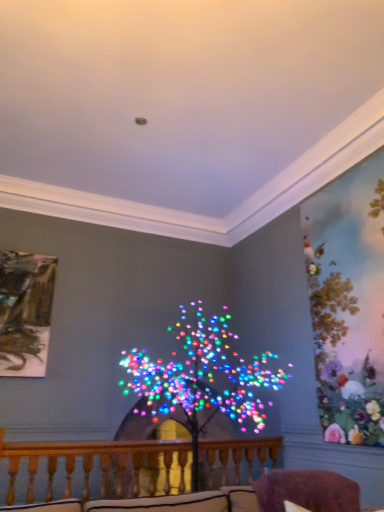
Locate an element on the screen. This screenshot has height=512, width=384. multicolored lights at center is located at coordinates (202, 377).

This screenshot has height=512, width=384. What are the coordinates of `purple fuzzy swivel chair at lower right` in the screenshot? It's located at click(307, 490).

Considering the relative sizes of multicolored lights at center and purple fuzzy swivel chair at lower right in the image provided, is multicolored lights at center bigger than purple fuzzy swivel chair at lower right?

Correct, multicolored lights at center is larger in size than purple fuzzy swivel chair at lower right.

Could you tell me if multicolored lights at center is turned towards purple fuzzy swivel chair at lower right?

Yes, multicolored lights at center is oriented towards purple fuzzy swivel chair at lower right.

Does point (174, 391) lie behind point (332, 474)?

That is True.

Is multicolored lights at center thinner than purple fuzzy swivel chair at lower right?

No, multicolored lights at center is not thinner than purple fuzzy swivel chair at lower right.

Locate an element on the screen. This screenshot has height=512, width=384. christmas decoration on the right of wooden at center is located at coordinates (202, 377).

Considering the sizes of objects multicolored lights at center and wooden at center in the image provided, who is thinner, multicolored lights at center or wooden at center?

Thinner between the two is wooden at center.

From the image's perspective, is multicolored lights at center positioned above or below wooden at center?

Based on their image positions, multicolored lights at center is located above wooden at center.

Is point (247, 368) farther from camera compared to point (3, 455)?

That is True.

Between wooden at center and multicolored lights at center, which one appears on the right side from the viewer's perspective?

Positioned to the right is multicolored lights at center.

From a real-world perspective, who is located higher, wooden at center or multicolored lights at center?

From a 3D spatial view, multicolored lights at center is above.

Does wooden at center turn towards multicolored lights at center?

Yes, wooden at center is oriented towards multicolored lights at center.

Is purple fuzzy swivel chair at lower right situated inside wooden at center or outside?

purple fuzzy swivel chair at lower right is not enclosed by wooden at center.

From a real-world perspective, who is located higher, purple fuzzy swivel chair at lower right or wooden at center?

purple fuzzy swivel chair at lower right, from a real-world perspective.

Could you tell me if purple fuzzy swivel chair at lower right is facing wooden at center?

No, purple fuzzy swivel chair at lower right is not aimed at wooden at center.

From the image's perspective, between purple fuzzy swivel chair at lower right and wooden at center, who is located below?

wooden at center appears lower in the image.

Is purple fuzzy swivel chair at lower right shorter than multicolored lights at center?

Indeed, purple fuzzy swivel chair at lower right has a lesser height compared to multicolored lights at center.

Could you tell me if purple fuzzy swivel chair at lower right is turned towards multicolored lights at center?

No.

Is purple fuzzy swivel chair at lower right next to multicolored lights at center?

No, purple fuzzy swivel chair at lower right is not touching multicolored lights at center.

In the image, there is a purple fuzzy swivel chair at lower right. At what (x,y) coordinates should I click in order to perform the action: click on christmas decoration below it (from the image's perspective). Please return your answer as a coordinate pair (x, y). This screenshot has height=512, width=384. Looking at the image, I should click on (202, 377).

Does wooden at center have a lesser height compared to purple fuzzy swivel chair at lower right?

No, wooden at center is not shorter than purple fuzzy swivel chair at lower right.

Is purple fuzzy swivel chair at lower right a part of wooden at center?

Actually, purple fuzzy swivel chair at lower right is outside wooden at center.

Are wooden at center and purple fuzzy swivel chair at lower right beside each other?

No, wooden at center is not in contact with purple fuzzy swivel chair at lower right.

Which object is positioned more to the left, wooden at center or purple fuzzy swivel chair at lower right?

wooden at center is more to the left.

Image resolution: width=384 pixels, height=512 pixels. Identify the location of swivel chair below the multicolored lights at center (from a real-world perspective). (307, 490).

Image resolution: width=384 pixels, height=512 pixels. In order to click on christmas decoration positioned vertically above the wooden at center (from a real-world perspective) in this screenshot , I will do `click(202, 377)`.

When comparing their distances from purple fuzzy swivel chair at lower right, does wooden at center or multicolored lights at center seem closer?

multicolored lights at center lies closer to purple fuzzy swivel chair at lower right than the other object.

Which object lies nearer to the anchor point multicolored lights at center, purple fuzzy swivel chair at lower right or wooden at center?

wooden at center is positioned closer to the anchor multicolored lights at center.

Based on their spatial positions, is wooden at center or purple fuzzy swivel chair at lower right further from multicolored lights at center?

purple fuzzy swivel chair at lower right is further to multicolored lights at center.

Considering their positions, is multicolored lights at center positioned further to wooden at center than purple fuzzy swivel chair at lower right?

Among the two, purple fuzzy swivel chair at lower right is located further to wooden at center.

Based on their spatial positions, is purple fuzzy swivel chair at lower right or multicolored lights at center closer to wooden at center?

multicolored lights at center is positioned closer to the anchor wooden at center.

Which object lies nearer to the anchor point purple fuzzy swivel chair at lower right, multicolored lights at center or wooden at center?

Based on the image, multicolored lights at center appears to be nearer to purple fuzzy swivel chair at lower right.

This screenshot has height=512, width=384. Identify the location of christmas decoration located between purple fuzzy swivel chair at lower right and wooden at center in the depth direction. (202, 377).